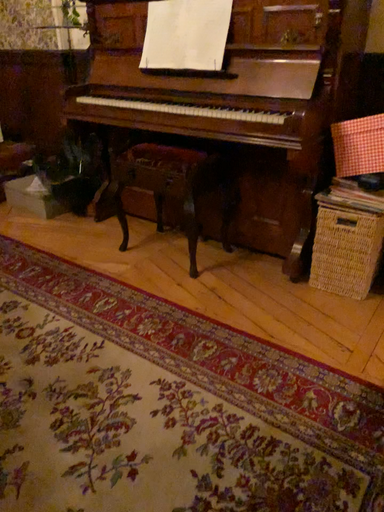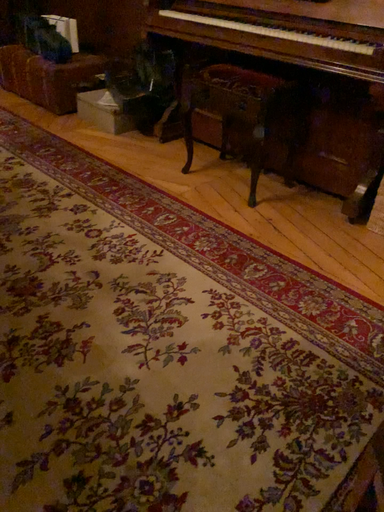
Question: Which way did the camera rotate in the video?

Choices:
 (A) rotated downward
 (B) rotated upward

Answer: (A)